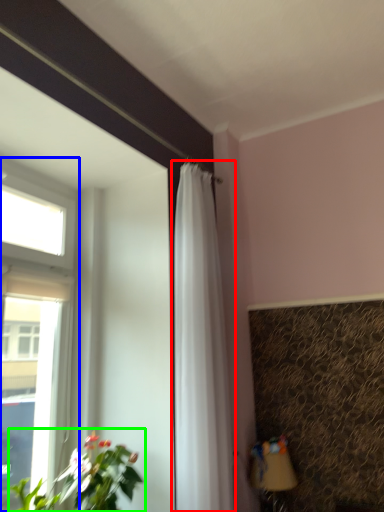
Question: Which object is the farthest from curtain (highlighted by a red box)? Choose among these: window (highlighted by a blue box) or houseplant (highlighted by a green box).

Choices:
 (A) window
 (B) houseplant

Answer: (A)